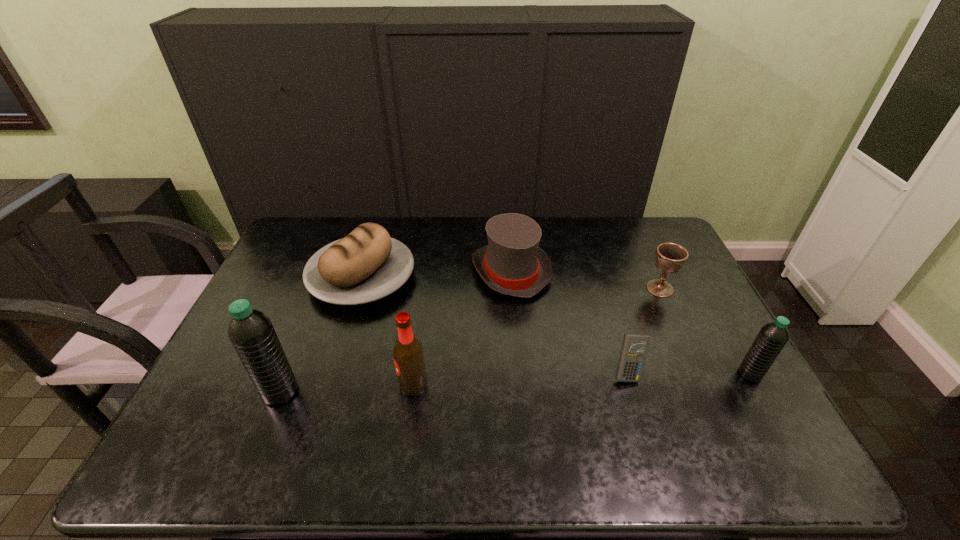
Locate an element on the screen. the left water bottle is located at coordinates (251, 332).

What are the coordinates of `the tallest object` in the screenshot? It's located at (251, 332).

The height and width of the screenshot is (540, 960). Identify the location of the fifth shortest object. (773, 336).

The height and width of the screenshot is (540, 960). Find the location of `the shorter water bottle`. the shorter water bottle is located at coordinates (773, 336).

The height and width of the screenshot is (540, 960). What are the coordinates of `chalice` in the screenshot? It's located at (670, 257).

This screenshot has width=960, height=540. I want to click on bread, so click(x=366, y=265).

Identify the location of the fourth object from right to left. (512, 263).

Where is `the third object from right to left`? the third object from right to left is located at coordinates (634, 346).

The image size is (960, 540). Identify the location of the shortest object. (634, 346).

Find the location of a particular element. Image resolution: width=960 pixels, height=540 pixels. the third object from left to right is located at coordinates (408, 354).